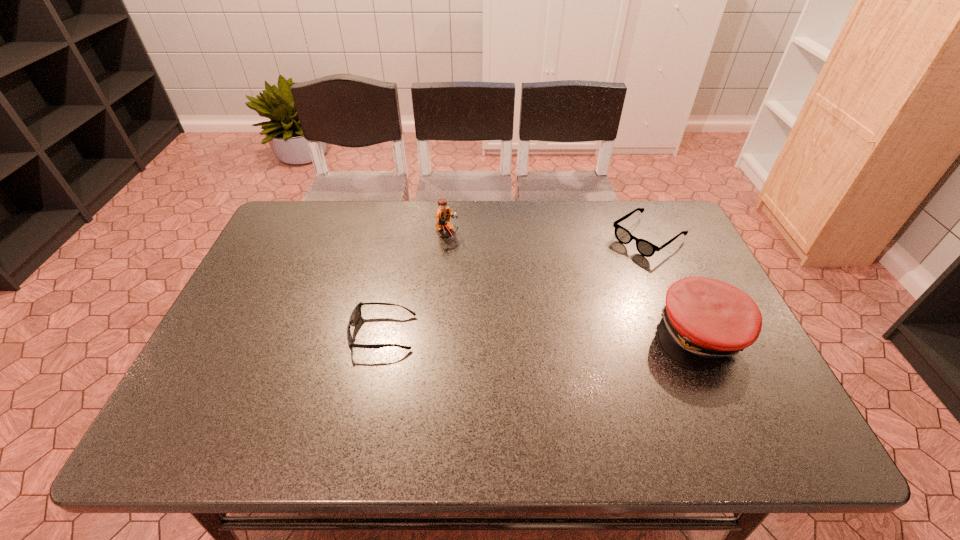
At what (x,y) coordinates should I click in order to perform the action: click on the shortest object. Please return your answer as a coordinate pair (x, y). Looking at the image, I should click on point(356,314).

The image size is (960, 540). Identify the location of sunglasses. coord(356,314).

This screenshot has width=960, height=540. I want to click on cap, so click(x=705, y=321).

At what (x,y) coordinates should I click in order to perform the action: click on the second shortest object. Please return your answer as a coordinate pair (x, y). The width and height of the screenshot is (960, 540). Looking at the image, I should click on (645, 248).

At what (x,y) coordinates should I click in order to perform the action: click on the second object from left to right. Please return your answer as a coordinate pair (x, y). Looking at the image, I should click on (443, 214).

This screenshot has width=960, height=540. What are the coordinates of `vacant region located 0.290m on the front-facing side of the sunglasses` in the screenshot? It's located at (235, 333).

You are a GUI agent. You are given a task and a screenshot of the screen. Output one action in this format:
    pyautogui.click(x=<x>, y=<y>)
    Task: Click on the vacant space located 0.220m on the front-facing side of the sunglasses
    This screenshot has width=960, height=540.
    Given the screenshot: What is the action you would take?
    pyautogui.click(x=263, y=333)

Where is `free spot located 0.320m on the front-facing side of the sunglasses`? free spot located 0.320m on the front-facing side of the sunglasses is located at coordinates (223, 333).

Locate an element on the screen. The image size is (960, 540). free spot located 0.080m on the front-facing side of the cap is located at coordinates (730, 402).

Where is `free location located 0.330m on the arms of the third tallest object`? Image resolution: width=960 pixels, height=540 pixels. free location located 0.330m on the arms of the third tallest object is located at coordinates (549, 307).